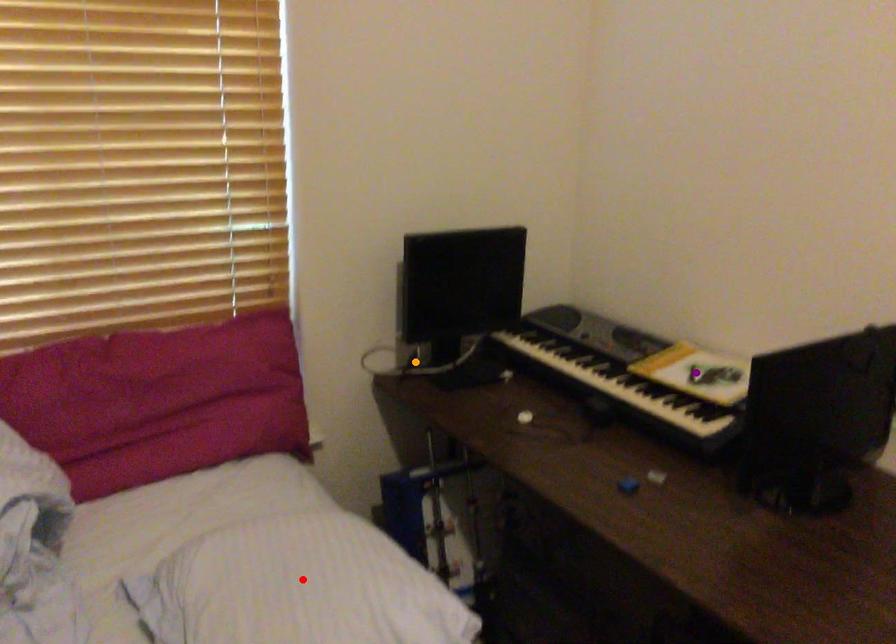
Order these from nearest to farthest:
A) red point
B) purple point
C) orange point

1. orange point
2. purple point
3. red point